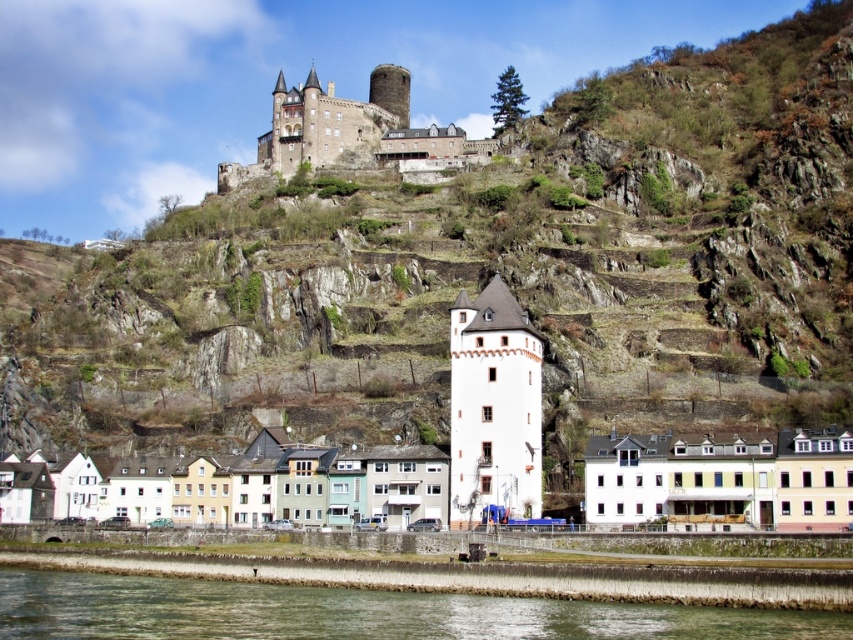
Question: Which object is the farthest from the white matte building at lower center?

Choices:
 (A) white smooth tower at center
 (B) clear water at lower center
 (C) stone castle at upper center
 (D) brown rocky hillside at upper center

Answer: (C)

Question: Is clear water at lower center below white matte building at lower center?

Choices:
 (A) no
 (B) yes

Answer: (B)

Question: Can you confirm if white matte building at lower center is bigger than white smooth tower at center?

Choices:
 (A) yes
 (B) no

Answer: (A)

Question: Estimate the real-world distances between objects in this image. Which object is closer to the white smooth tower at center?

Choices:
 (A) stone castle at upper center
 (B) clear water at lower center

Answer: (B)

Question: Can you confirm if brown rocky hillside at upper center is smaller than white smooth tower at center?

Choices:
 (A) yes
 (B) no

Answer: (B)

Question: Estimate the real-world distances between objects in this image. Which object is farther from the stone castle at upper center?

Choices:
 (A) clear water at lower center
 (B) brown rocky hillside at upper center

Answer: (A)